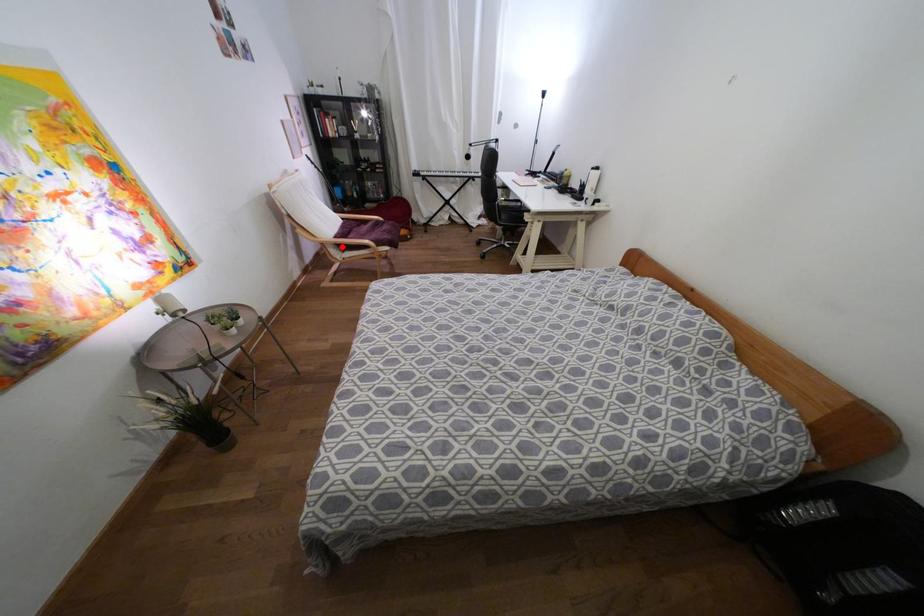
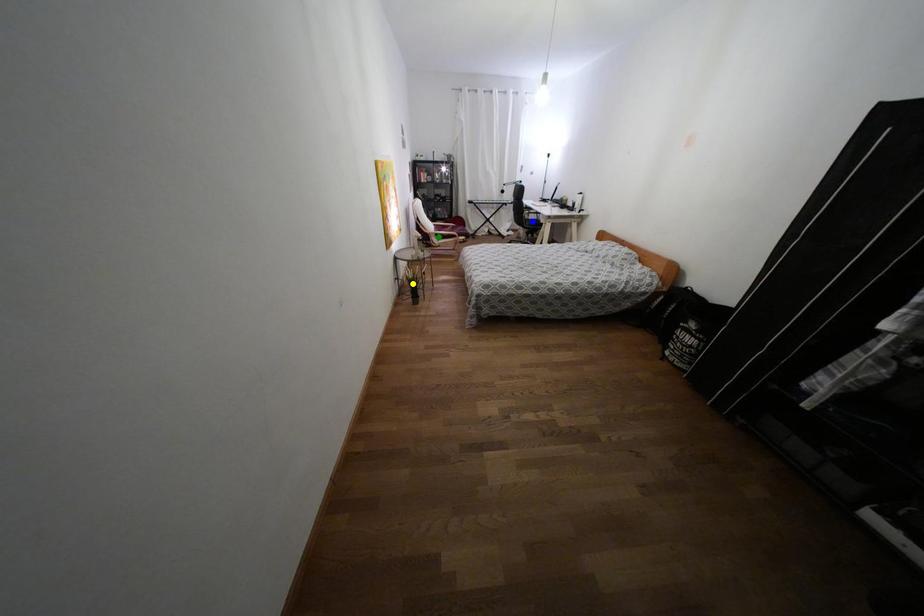
Question: I am providing you with two images of the same scene from different viewpoints. A red point is marked on the first image. You are given multiple points on the second image. Which mark in image 2 goes with the point in image 1?

Choices:
 (A) yellow point
 (B) green point
 (C) blue point

Answer: (B)